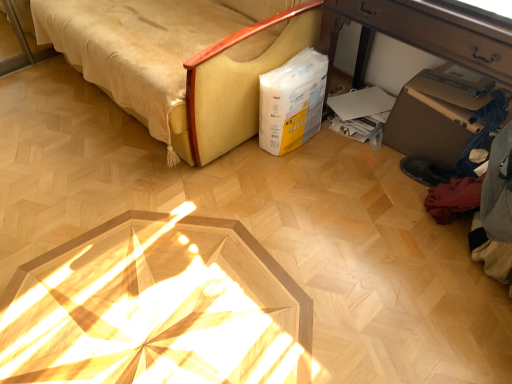
Find the location of `vacant position to the left of brown cardboard box at lower right`. vacant position to the left of brown cardboard box at lower right is located at coordinates (351, 165).